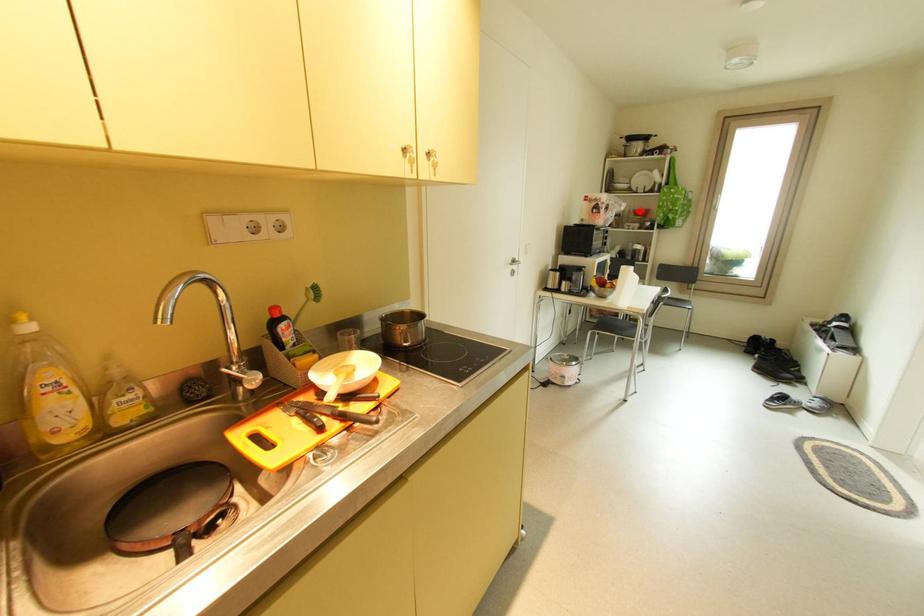
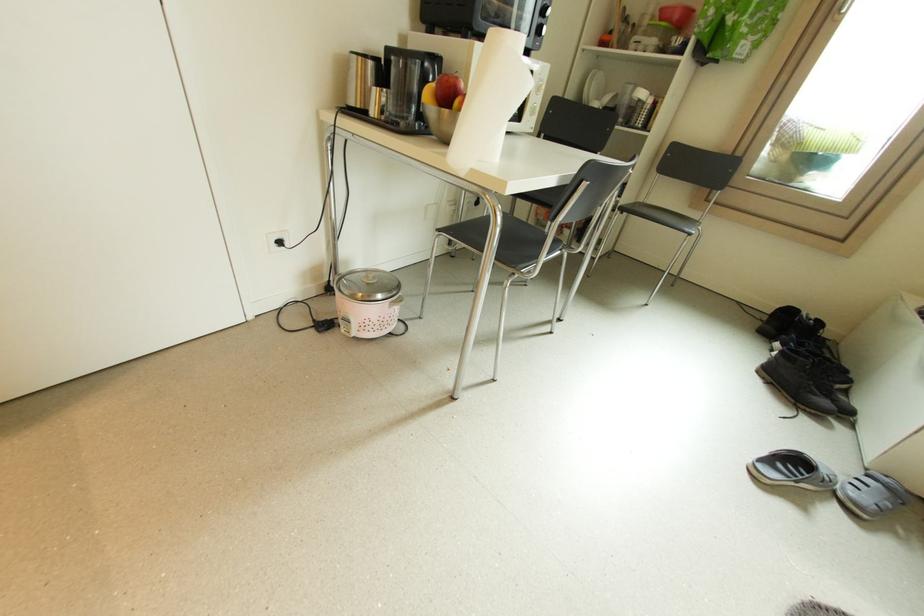
Question: A red point is marked in image1. In image2, is the corresponding 3D point closer to the camera or farther? Reply with the corresponding letter.

Choices:
 (A) The corresponding 3D point is closer.
 (B) The corresponding 3D point is farther.

Answer: (B)